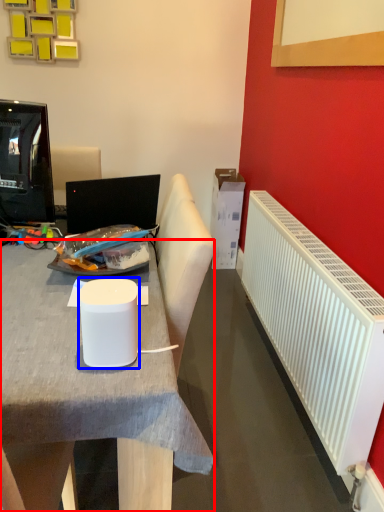
Question: Which of the following is the farthest to the observer, desk (highlighted by a red box) or paper cup (highlighted by a blue box)?

Choices:
 (A) desk
 (B) paper cup

Answer: (A)